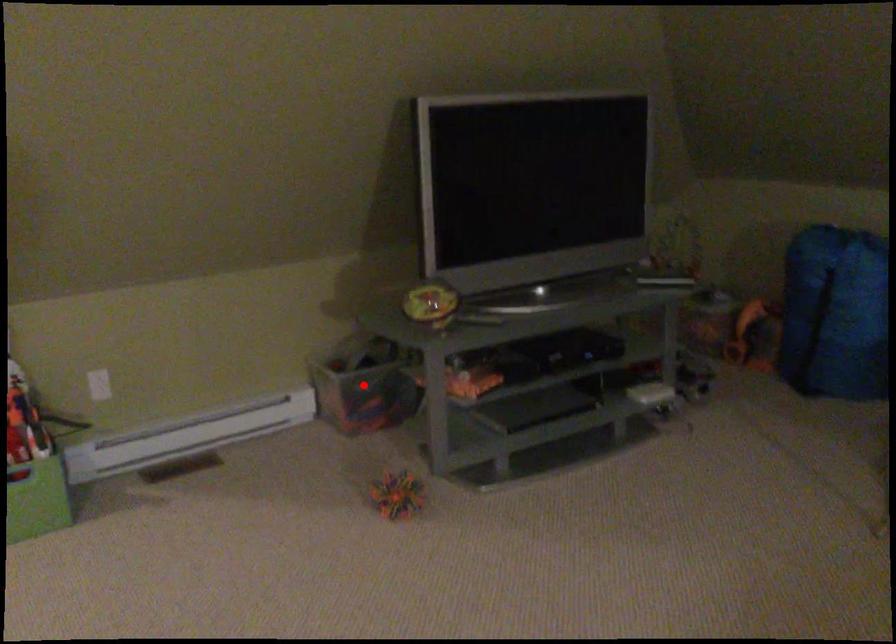
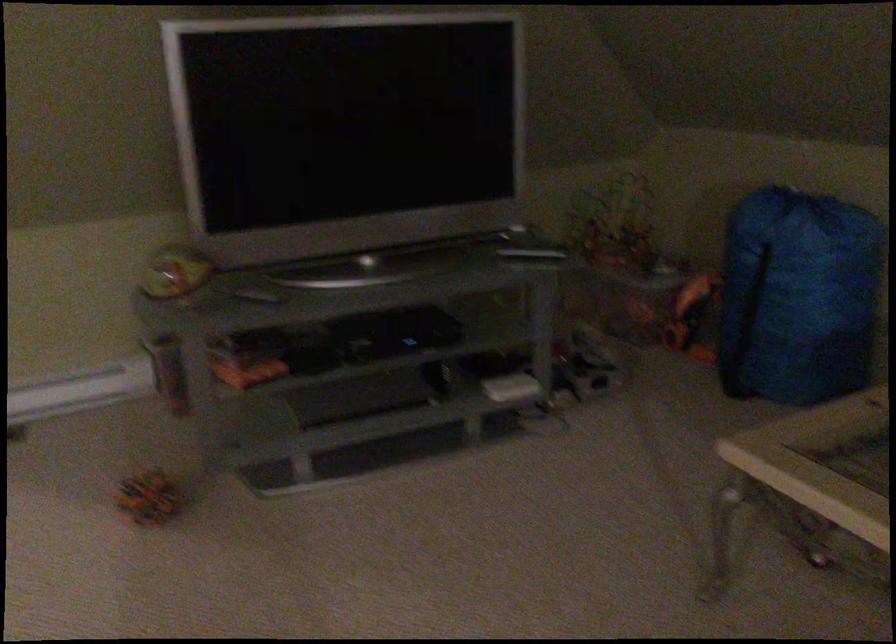
Question: I am providing you with two images of the same scene from different viewpoints. A red point is marked on the first image. At the location where the point appears in image 1, is it still visible in image 2?

Choices:
 (A) Yes
 (B) No

Answer: (B)